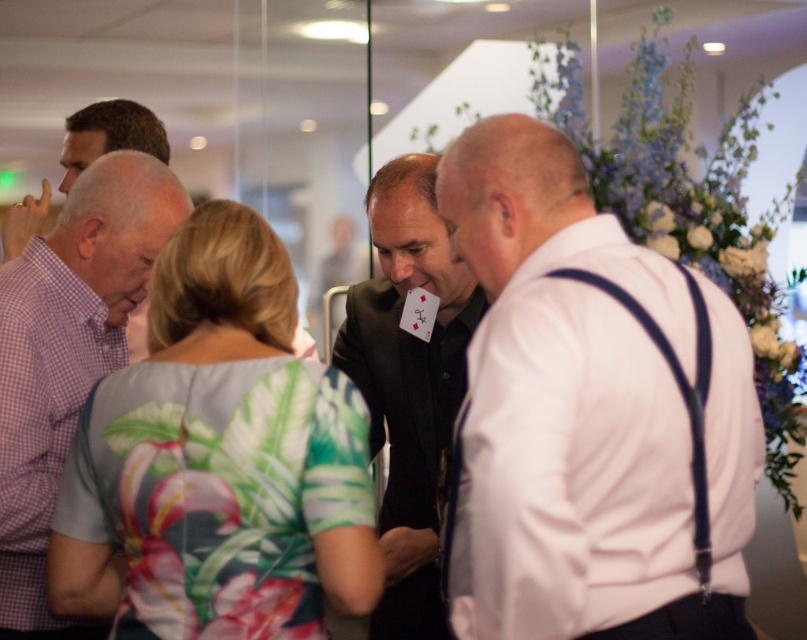
Question: Which point appears farthest from the camera in this image?

Choices:
 (A) (23, 294)
 (B) (65, 176)
 (C) (408, 273)
 (D) (483, 486)

Answer: (B)

Question: Does white matte shirt at right have a greater width compared to black matte suit at center?

Choices:
 (A) no
 (B) yes

Answer: (B)

Question: Does purple checkered shirt at left lie in front of checkered fabric shirt at left?

Choices:
 (A) no
 (B) yes

Answer: (B)

Question: Estimate the real-world distances between objects in this image. Which object is closer to the floral print dress at center?

Choices:
 (A) black matte suit at center
 (B) purple checkered shirt at left
 (C) white matte shirt at right

Answer: (B)

Question: Estimate the real-world distances between objects in this image. Which object is closer to the white matte shirt at right?

Choices:
 (A) purple checkered shirt at left
 (B) checkered fabric shirt at left
 (C) black matte suit at center

Answer: (C)

Question: Can you confirm if purple checkered shirt at left is positioned to the right of black matte suit at center?

Choices:
 (A) yes
 (B) no

Answer: (B)